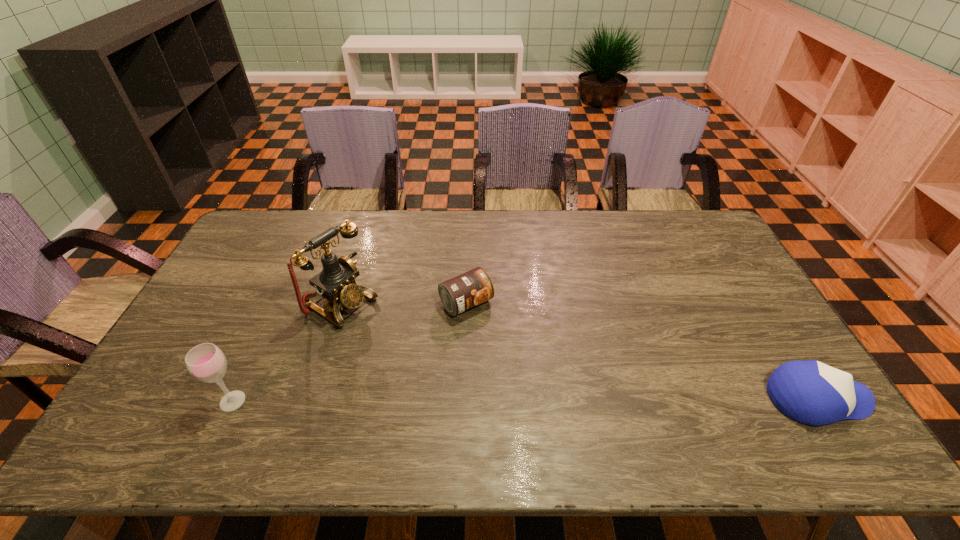
What are the coordinates of `object that stands as the closest to the can` in the screenshot? It's located at (336, 282).

The height and width of the screenshot is (540, 960). What are the coordinates of `object that stands as the third closest to the second tallest object` in the screenshot? It's located at (x=810, y=392).

Identify the location of blank area in the image that satisfies the following two spatial constraints: 1. on the back side of the third object from left to right; 2. on the left side of the tallest object. Image resolution: width=960 pixels, height=540 pixels. (343, 303).

Locate an element on the screen. blank area in the image that satisfies the following two spatial constraints: 1. on the front side of the second object from right to left; 2. on the front-facing side of the rightmost object is located at coordinates (464, 399).

At what (x,y) coordinates should I click in order to perform the action: click on free location that satisfies the following two spatial constraints: 1. on the front side of the third object from right to left; 2. on the front-facing side of the baseball cap. Please return your answer as a coordinate pair (x, y). Looking at the image, I should click on (313, 399).

I want to click on free space that satisfies the following two spatial constraints: 1. on the front side of the baseball cap; 2. on the front-facing side of the telephone, so pyautogui.click(x=313, y=399).

Where is `blank area in the image that satisfies the following two spatial constraints: 1. on the front side of the tallest object; 2. on the front-facing side of the baseball cap`? This screenshot has width=960, height=540. blank area in the image that satisfies the following two spatial constraints: 1. on the front side of the tallest object; 2. on the front-facing side of the baseball cap is located at coordinates (313, 399).